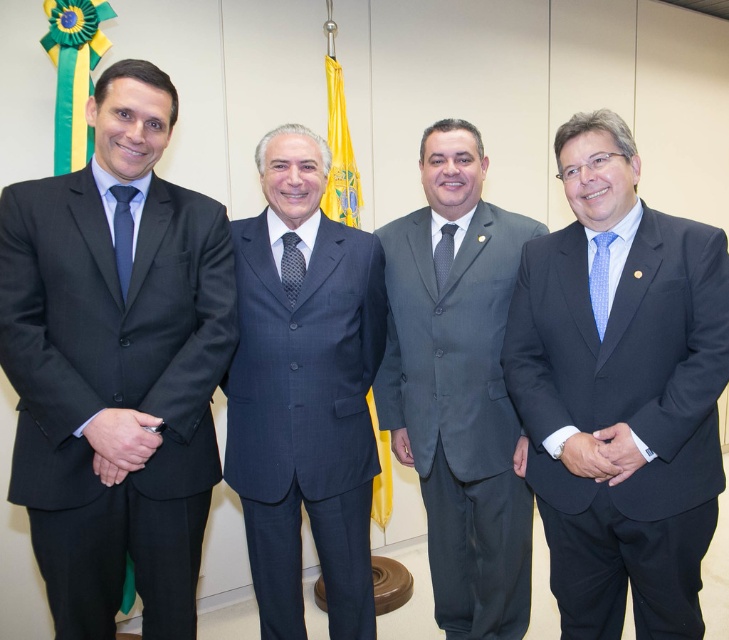
You are a photographer at this event and need to place a small podium exactly at point [116,365]. Which object from the scene will the podium be placed closest to?

The podium will be placed closest to the matte black suit at left.

You are a photographer at a formal event. You need to capture a closeup shot of the dark blue suit at center and the blue dotted fabric tie at right. Which object should you focus on first if you want to ensure both are in focus without adjusting the camera settings?

The dark blue suit at center is bigger than the blue dotted fabric tie at right, so focusing on the larger object first would help maintain focus on both.

You are an event planner arranging a photo shoot. The photographer wants to ensure the dark blue suit at center is positioned exactly at the center of the frame. Currently, it is at point 0.616, 0.418. Is it centered?

The dark blue suit at center is located at point [304,394], which means it is not exactly at the center of the frame since the true center would be at [364,320].